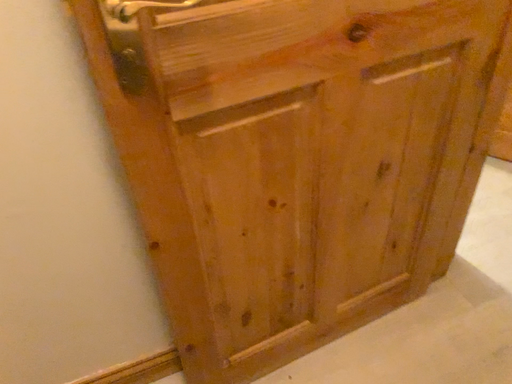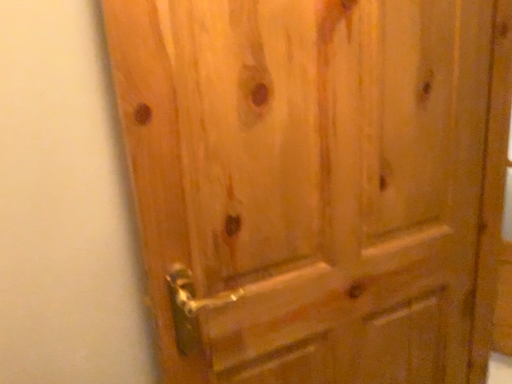
Question: Which way did the camera rotate in the video?

Choices:
 (A) rotated downward
 (B) rotated upward

Answer: (B)